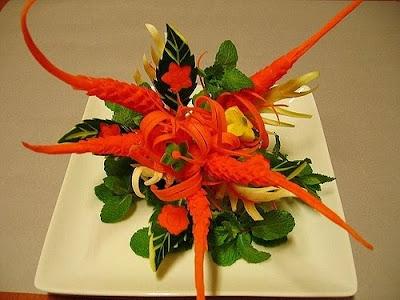
This screenshot has height=300, width=400. What are the coordinates of `plate` in the screenshot? It's located at (313, 253).